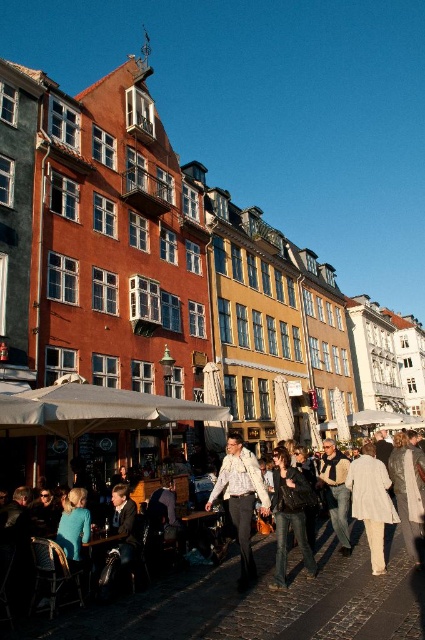
From the picture: You are standing on the cobblestone pavement of this European town street and notice two points marked on the ground. The first point is at coordinate point(371, 624) and the second is at point(348, 538). If you were to walk from the first point to the second, would you be moving towards the buildings or away from them?

The point(371, 624) is in front of point(348, 538). So moving from the first point to the second would mean moving away from the buildings since the first point is closer to the buildings than the second one.

You are a tourist standing on the cobblestone pavement and see both the denim jacket at lower center and the leather jacket at center. Which jacket is positioned more to the left side of the street?

The denim jacket at lower center is positioned to the left of the leather jacket at center, so the denim jacket at lower center is more to the left side of the street.

You are a photographer trying to capture a candid shot of the white textured shirt at center and denim jeans at center in the busy street scene. To ensure both are fully visible in the frame, which clothing item should you focus on first to account for their size?

The white textured shirt at center might be wider than denim jeans at center, so you should focus on positioning the white textured shirt at center first to ensure it fits within the camera frame.